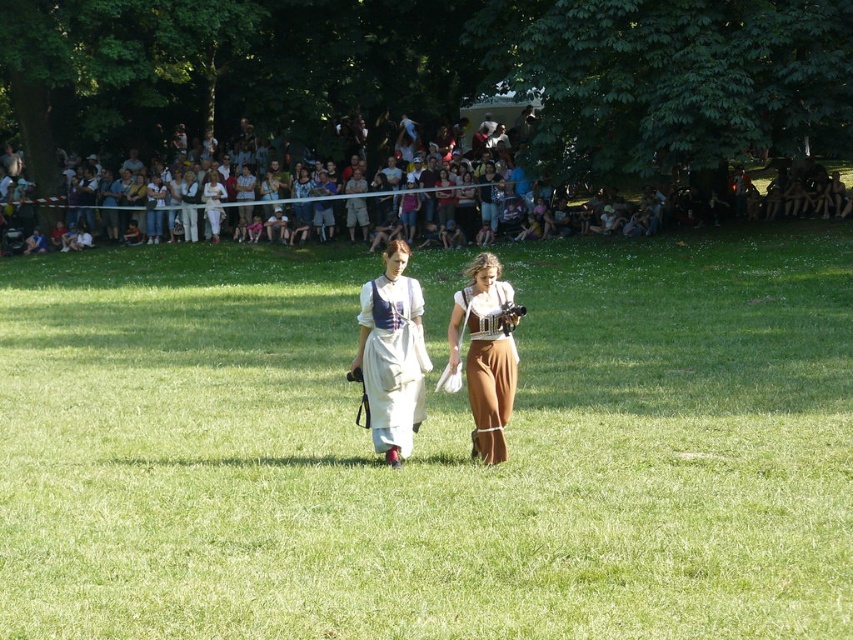
Who is positioned more to the left, white casual clothing at upper center or matte white dress at center?

Positioned to the left is white casual clothing at upper center.

Does white casual clothing at upper center have a smaller size compared to matte white dress at center?

No, white casual clothing at upper center is not smaller than matte white dress at center.

The width and height of the screenshot is (853, 640). Find the location of `white casual clothing at upper center`. white casual clothing at upper center is located at coordinates (403, 205).

This screenshot has height=640, width=853. In order to click on white casual clothing at upper center in this screenshot , I will do `click(403, 205)`.

Who is lower down, white casual clothing at upper center or brown leather pants at center?

Positioned lower is brown leather pants at center.

From the picture: Between white casual clothing at upper center and brown leather pants at center, which one is positioned higher?

white casual clothing at upper center

Find the location of a particular element. This screenshot has height=640, width=853. white casual clothing at upper center is located at coordinates (403, 205).

Does green grass at center lie in front of matte white dress at center?

Yes.

Describe the element at coordinates (428, 448) in the screenshot. This screenshot has height=640, width=853. I see `green grass at center` at that location.

Locate an element on the screen. green grass at center is located at coordinates (428, 448).